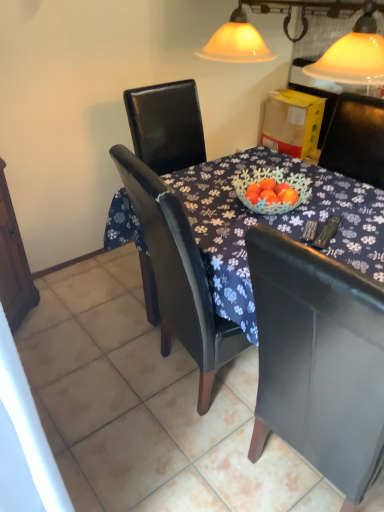
You are a GUI agent. You are given a task and a screenshot of the screen. Output one action in this format:
    pyautogui.click(x=<x>, y=<y>)
    Task: Click on the dark wood table at center
    Image resolution: width=384 pixels, height=512 pixels.
    Given the screenshot: What is the action you would take?
    pyautogui.click(x=273, y=224)

Describe the element at coordinates (273, 224) in the screenshot. I see `dark wood table at center` at that location.

What is the approximate height of black leather chair at center?

black leather chair at center is 1.08 meters in height.

The height and width of the screenshot is (512, 384). Identify the location of black leather chair at center. (318, 360).

This screenshot has height=512, width=384. What do you see at coordinates (318, 360) in the screenshot?
I see `black leather chair at center` at bounding box center [318, 360].

The height and width of the screenshot is (512, 384). I want to click on dark wood table at center, so click(x=273, y=224).

Which object is positioned more to the left, black leather chair at center or dark wood table at center?

Positioned to the left is dark wood table at center.

Is black leather chair at center positioned in front of dark wood table at center?

Yes, it is in front of dark wood table at center.

Which point is more forward, (356, 296) or (249, 274)?

The point (356, 296) is in front.

In the scene shown: From the image's perspective, is black leather chair at center located beneath dark wood table at center?

Yes, from the image's perspective, black leather chair at center is below dark wood table at center.

From a real-world perspective, is black leather chair at center physically above dark wood table at center?

Incorrect, from a real-world perspective, black leather chair at center is lower than dark wood table at center.

Between black leather chair at center and dark wood table at center, which one has smaller width?

black leather chair at center.

Which of these two, black leather chair at center or dark wood table at center, stands shorter?

Standing shorter between the two is dark wood table at center.

Is black leather chair at center bigger or smaller than dark wood table at center?

black leather chair at center is smaller than dark wood table at center.

Is dark wood table at center completely or partially inside black leather chair at center?

No, dark wood table at center is not surrounded by black leather chair at center.

Can you see black leather chair at center touching dark wood table at center?

black leather chair at center and dark wood table at center are clearly separated.

Could you tell me if black leather chair at center is turned towards dark wood table at center?

No, black leather chair at center is not oriented towards dark wood table at center.

How distant is black leather chair at center from dark wood table at center?

black leather chair at center is 51.98 centimeters from dark wood table at center.

At what (x,y) coordinates should I click in order to perform the action: click on chair below the dark wood table at center (from a real-world perspective). Please return your answer as a coordinate pair (x, y). The image size is (384, 512). Looking at the image, I should click on (318, 360).

Considering the positions of objects dark wood table at center and black leather chair at center in the image provided, who is more to the right, dark wood table at center or black leather chair at center?

From the viewer's perspective, black leather chair at center appears more on the right side.

Which object is further away from the camera, dark wood table at center or black leather chair at center?

dark wood table at center is behind.

Does point (243, 211) appear closer or farther from the camera than point (314, 371)?

Point (243, 211) is farther from the camera than point (314, 371).

From the image's perspective, between dark wood table at center and black leather chair at center, who is located below?

black leather chair at center.

From a real-world perspective, is dark wood table at center physically located above or below black leather chair at center?

dark wood table at center is above black leather chair at center.

Considering the sizes of objects dark wood table at center and black leather chair at center in the image provided, who is wider, dark wood table at center or black leather chair at center?

With larger width is dark wood table at center.

Considering the sizes of objects dark wood table at center and black leather chair at center in the image provided, who is taller, dark wood table at center or black leather chair at center?

black leather chair at center is taller.

Based on the photo, considering the relative sizes of dark wood table at center and black leather chair at center in the image provided, is dark wood table at center bigger than black leather chair at center?

Yes, dark wood table at center is bigger than black leather chair at center.

Is dark wood table at center not within black leather chair at center?

dark wood table at center is positioned outside black leather chair at center.

In the scene shown: Is the surface of dark wood table at center in direct contact with black leather chair at center?

dark wood table at center and black leather chair at center are not in contact.

Is dark wood table at center looking in the opposite direction of black leather chair at center?

dark wood table at center is not turned away from black leather chair at center.

How distant is dark wood table at center from black leather chair at center?

dark wood table at center is 51.98 centimeters from black leather chair at center.

The image size is (384, 512). Find the location of `desk on the left of the black leather chair at center`. desk on the left of the black leather chair at center is located at coordinates (273, 224).

The height and width of the screenshot is (512, 384). I want to click on chair to the right of dark wood table at center, so click(318, 360).

Image resolution: width=384 pixels, height=512 pixels. Find the location of `desk behind the black leather chair at center`. desk behind the black leather chair at center is located at coordinates pyautogui.click(x=273, y=224).